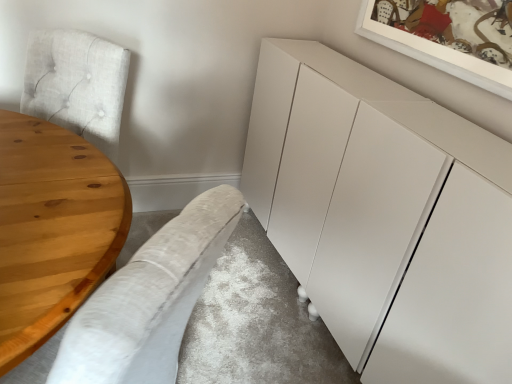
Question: Is natural wood table at left in front of or behind white matte cabinet at center in the image?

Choices:
 (A) front
 (B) behind

Answer: (A)

Question: Is natural wood table at left situated inside white matte cabinet at center or outside?

Choices:
 (A) inside
 (B) outside

Answer: (B)

Question: Which of these objects is positioned farthest from the light gray fabric couch at lower left?

Choices:
 (A) white matte cabinet at center
 (B) natural wood table at left

Answer: (A)

Question: Which object is the closest to the natural wood table at left?

Choices:
 (A) white matte cabinet at center
 (B) light gray fabric couch at lower left

Answer: (B)